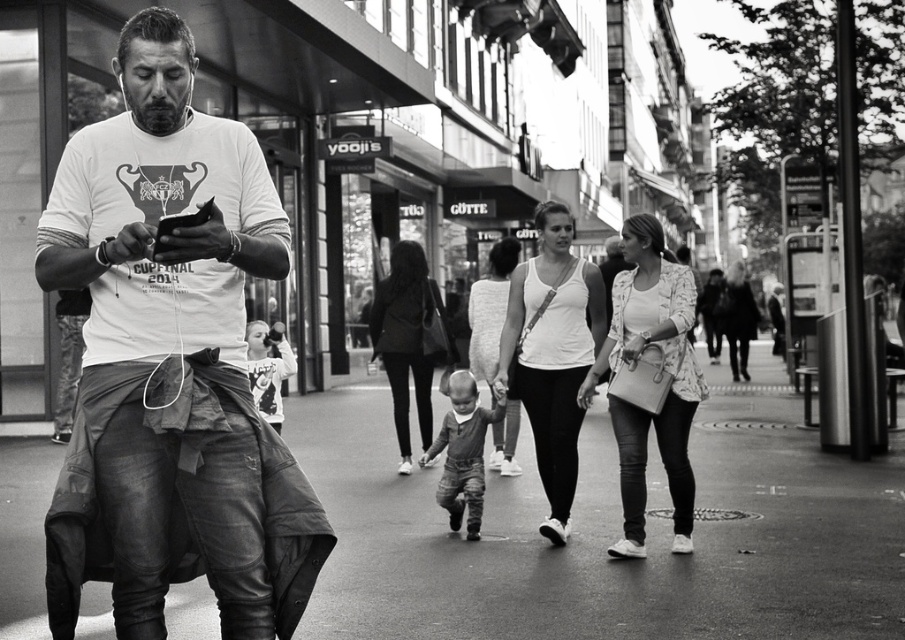
You are a photographer trying to capture a candid shot of the man in the foreground. The leather jacket at center and the light brown textured pants at center are in your viewfinder. Which object should you focus on to ensure the man is clearly visible in your photo?

The leather jacket at center is in front of the light brown textured pants at center, so focusing on the leather jacket at center will ensure the man is clearly visible.

In the scene, there is a smooth asphalt at center and a matte white tank top at center. Which object is taller?

The matte white tank top at center is taller than the smooth asphalt at center.

Looking at this image, you are a photographer trying to capture a candid shot of the man in the foreground. You notice the leather jacket at center and the light brown textured pants at center. Which item is positioned to the right side of the other?

The leather jacket at center is to the right of the light brown textured pants at center.